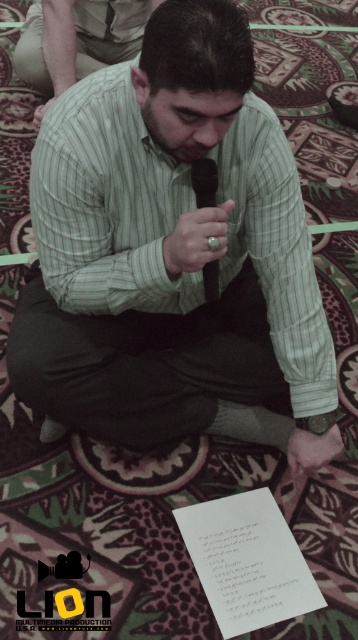
Question: Does green striped shirt at center appear under black silk tie at center?

Choices:
 (A) yes
 (B) no

Answer: (A)

Question: Which object appears farthest from the camera in this image?

Choices:
 (A) green striped shirt at center
 (B) black silk tie at center

Answer: (B)

Question: Which point is farther from the camera taking this photo?

Choices:
 (A) (216, 170)
 (B) (151, 243)

Answer: (B)

Question: Which point is closer to the camera?

Choices:
 (A) green striped shirt at center
 (B) black silk tie at center

Answer: (A)

Question: Is green striped shirt at center wider than black silk tie at center?

Choices:
 (A) no
 (B) yes

Answer: (B)

Question: Can you confirm if green striped shirt at center is positioned to the left of black silk tie at center?

Choices:
 (A) yes
 (B) no

Answer: (A)